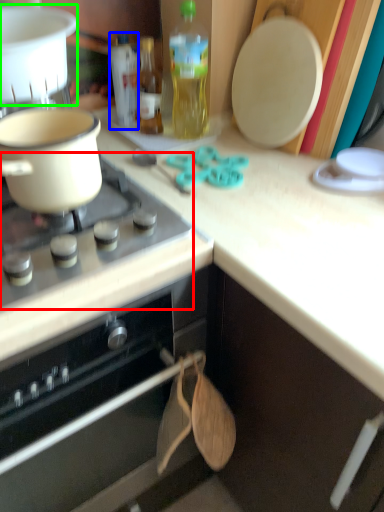
Question: Estimate the real-world distances between objects in this image. Which object is closer to gas stove (highlighted by a red box), bottle (highlighted by a blue box) or kitchen appliance (highlighted by a green box)?

Choices:
 (A) bottle
 (B) kitchen appliance

Answer: (B)